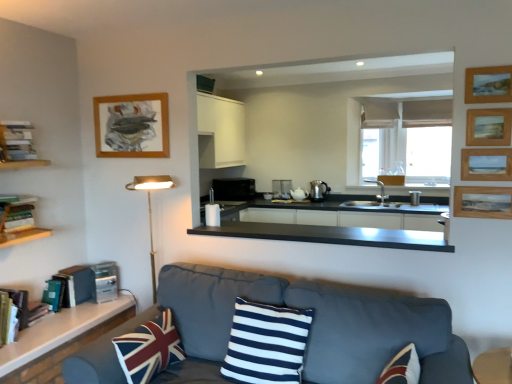
Question: Is hardcover books at left, acting as the third book starting from the back, situated inside navy blue and white striped cushion at center, positioned as the second pillow in left-to-right order, or outside?

Choices:
 (A) outside
 (B) inside

Answer: (A)

Question: From their relative heights in the image, would you say hardcover books at left, which is the first book from top to bottom, is taller or shorter than navy blue and white striped cushion at center, the first pillow positioned from the right?

Choices:
 (A) tall
 (B) short

Answer: (B)

Question: Which of these objects is positioned farthest from the wooden picture frame at upper right, placed as the 1th picture frame when sorted from front to back?

Choices:
 (A) satin silver toaster at lower left, which ranks as the first appliance in front-to-back order
 (B) wooden bookshelf at left
 (C) hardcover books at left, which is counted as the 3th book, starting from the bottom
 (D) metallic silver toaster at center, the second appliance from the front
 (E) wooden picture frame at upper right, positioned as the fourth picture frame in left-to-right order

Answer: (B)

Question: Which object is the closest to the hardcover book at lower left, the 3th book viewed from the top?

Choices:
 (A) wooden picture frame at upper right, the 5th picture frame positioned from the back
 (B) satin silver toaster at lower left, which is the first appliance from bottom to top
 (C) hardcover books at left, which is the first book from top to bottom
 (D) hardcover book at lower left, positioned as the second book in bottom-to-top order
 (E) union jack fabric pillow at lower left, marked as the 2th pillow in a right-to-left arrangement

Answer: (D)